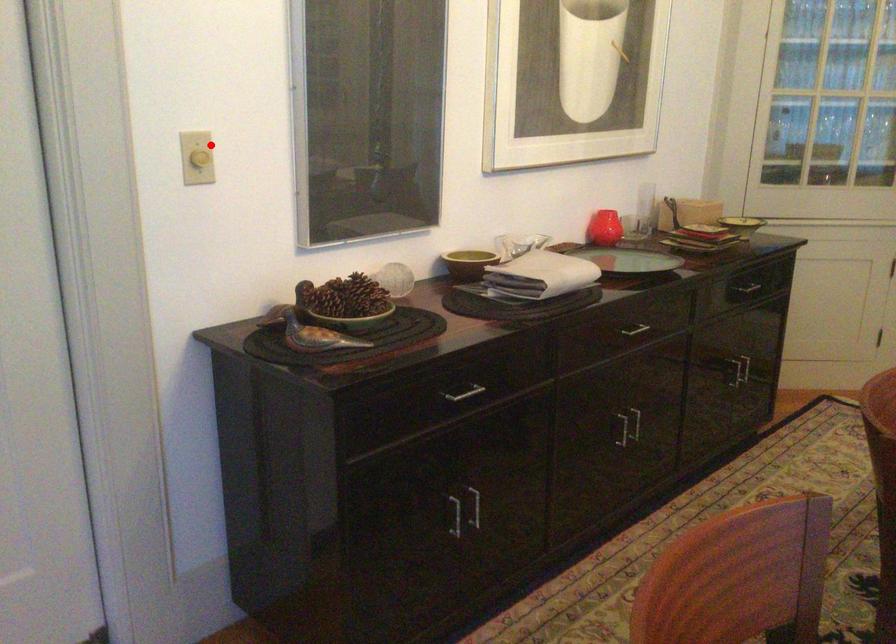
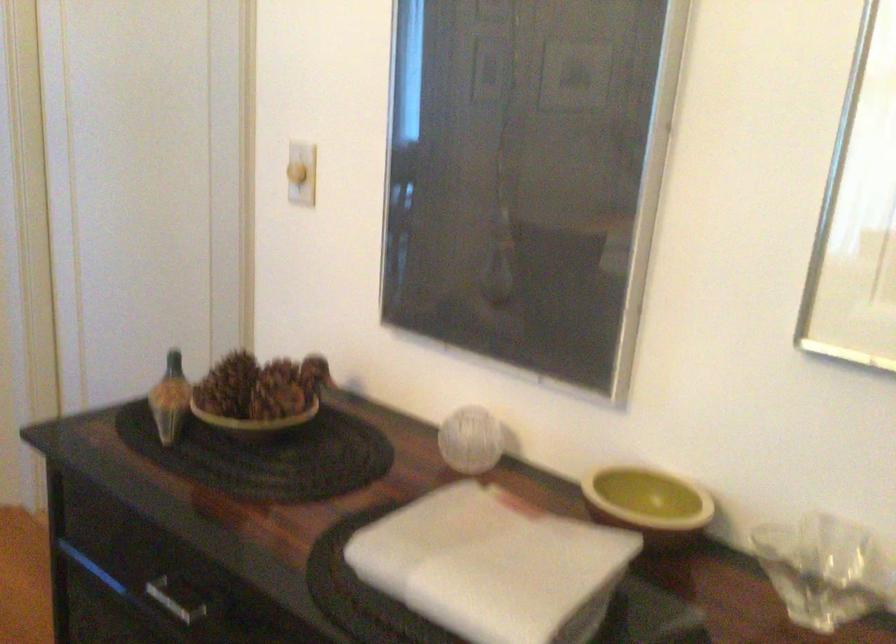
Question: I am providing you with two images of the same scene from different viewpoints. In image1, a red point is highlighted. Considering the same 3D point in image2, which of the following is correct?

Choices:
 (A) It is closer
 (B) It is farther

Answer: (A)